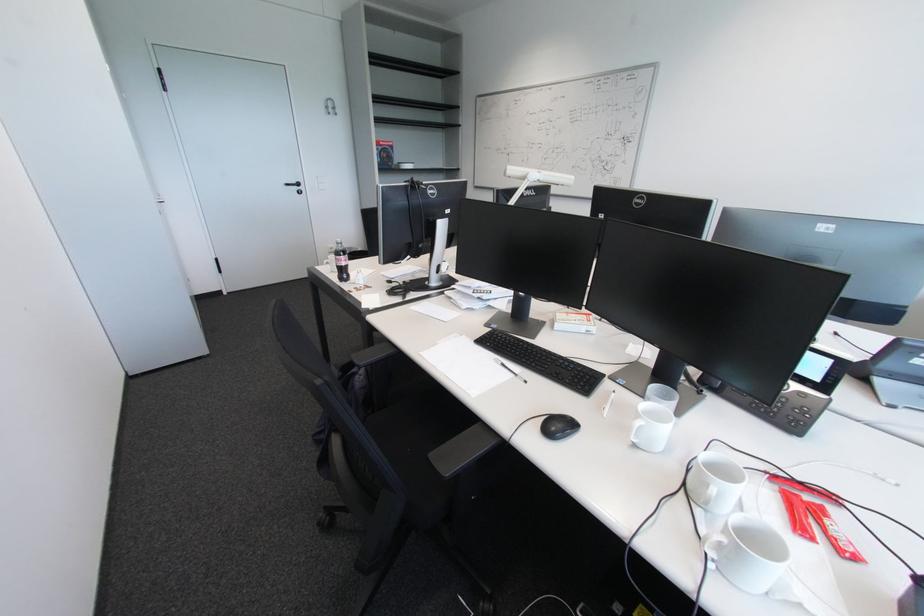
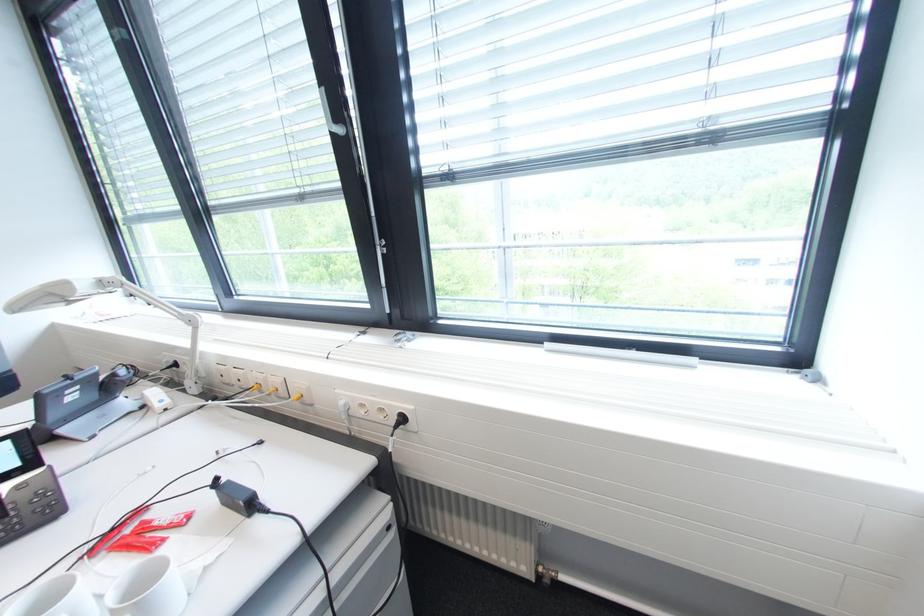
Find the pixel in the second image that matches pixel 747 508 in the first image.

(106, 599)